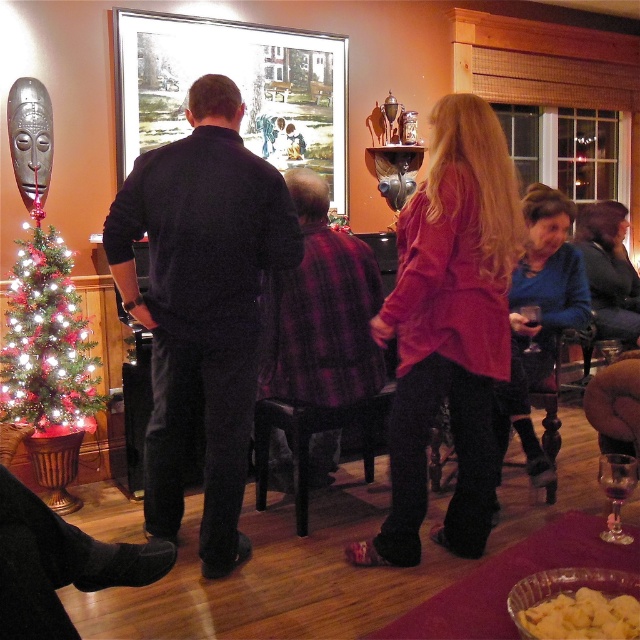
The width and height of the screenshot is (640, 640). Describe the element at coordinates (321, 312) in the screenshot. I see `plaid fabric shirt at center` at that location.

At what (x,y) coordinates should I click in order to perform the action: click on plaid fabric shirt at center. Please return your answer as a coordinate pair (x, y). Looking at the image, I should click on (321, 312).

You are a GUI agent. You are given a task and a screenshot of the screen. Output one action in this format:
    pyautogui.click(x=<x>, y=<y>)
    Task: Click on the plaid fabric shirt at center
    Image resolution: width=640 pixels, height=640 pixels.
    Given the screenshot: What is the action you would take?
    pyautogui.click(x=321, y=312)

Which of these two, dark blue fabric shirt at center or transparent glass at center, stands shorter?

transparent glass at center is shorter.

Does dark blue fabric shirt at center appear under transparent glass at center?

No, dark blue fabric shirt at center is not below transparent glass at center.

Identify the location of dark blue fabric shirt at center. (202, 305).

Based on the photo, is shiny red christmas tree at lower left shorter than transparent glass at center?

No, shiny red christmas tree at lower left is not shorter than transparent glass at center.

Is point (51, 410) closer to viewer compared to point (531, 317)?

That is False.

Is point (48, 323) farther from viewer compared to point (529, 349)?

No, (48, 323) is closer to viewer.

Locate an element on the screen. The height and width of the screenshot is (640, 640). shiny red christmas tree at lower left is located at coordinates (45, 340).